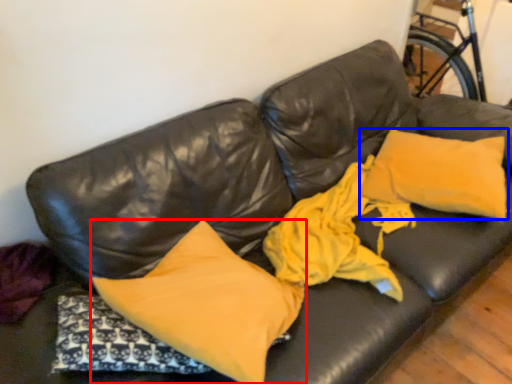
Question: Which object is further to the camera taking this photo, pillow (highlighted by a red box) or pillow (highlighted by a blue box)?

Choices:
 (A) pillow
 (B) pillow

Answer: (B)